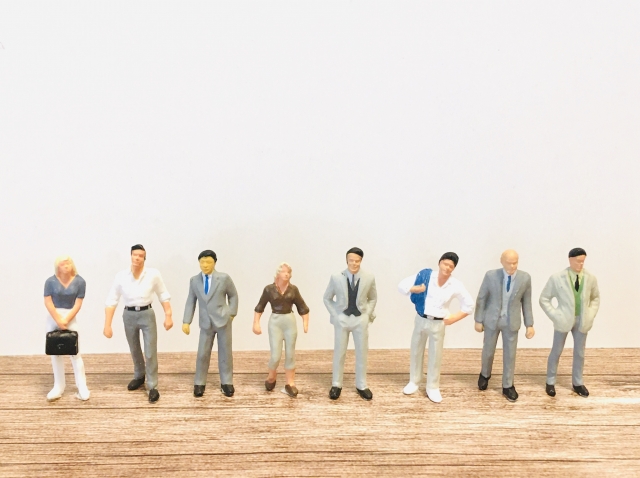
The image size is (640, 478). I want to click on people figurines, so click(67, 294), click(136, 288), click(211, 294), click(283, 306), click(352, 302), click(438, 297), click(508, 295), click(592, 304).